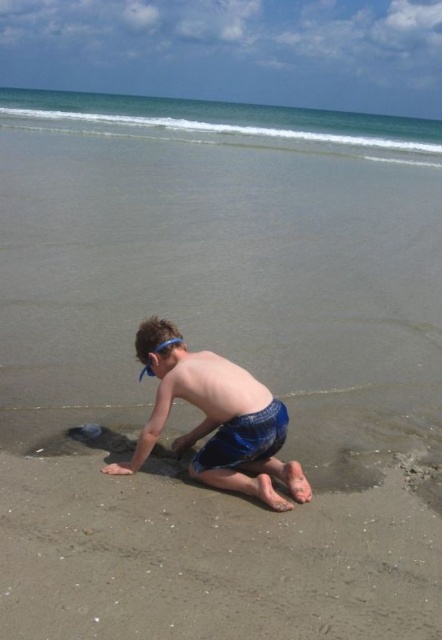
Which is more to the right, sandy at lower center or blue water at upper center?

From the viewer's perspective, sandy at lower center appears more on the right side.

Which is in front, point (30, 577) or point (384, 152)?

Point (30, 577) is more forward.

The width and height of the screenshot is (442, 640). Find the location of `sandy at lower center`. sandy at lower center is located at coordinates (218, 540).

Between blue fabric boy at center and blue fabric shorts at lower center, which one appears on the right side from the viewer's perspective?

blue fabric shorts at lower center is more to the right.

Who is more distant from viewer, [281,406] or [168,384]?

The point [281,406] is more distant.

Which is in front, point (144, 365) or point (217, 410)?

Point (217, 410)

Identify the location of blue fabric boy at center. The image size is (442, 640). (216, 419).

Is point (278, 141) behind point (201, 380)?

Yes, point (278, 141) is behind point (201, 380).

Between blue water at upper center and blue fabric shorts at lower center, which one is positioned lower?

blue fabric shorts at lower center is lower down.

Where is `blue water at upper center`? This screenshot has width=442, height=640. blue water at upper center is located at coordinates (227, 124).